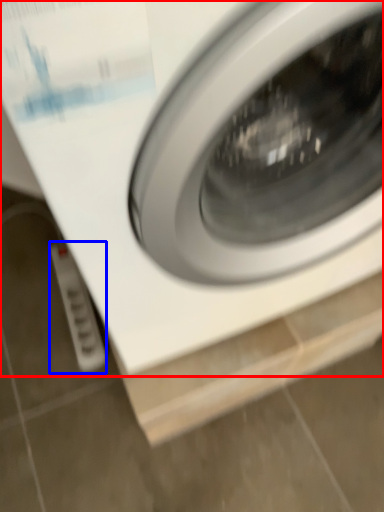
Question: Which of the following is the closest to the observer, washing machine (highlighted by a red box) or electric outlet (highlighted by a blue box)?

Choices:
 (A) washing machine
 (B) electric outlet

Answer: (A)